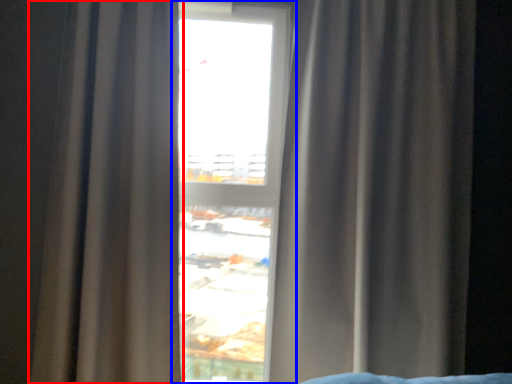
Question: Among these objects, which one is nearest to the camera, curtain (highlighted by a red box) or window (highlighted by a blue box)?

Choices:
 (A) curtain
 (B) window

Answer: (A)